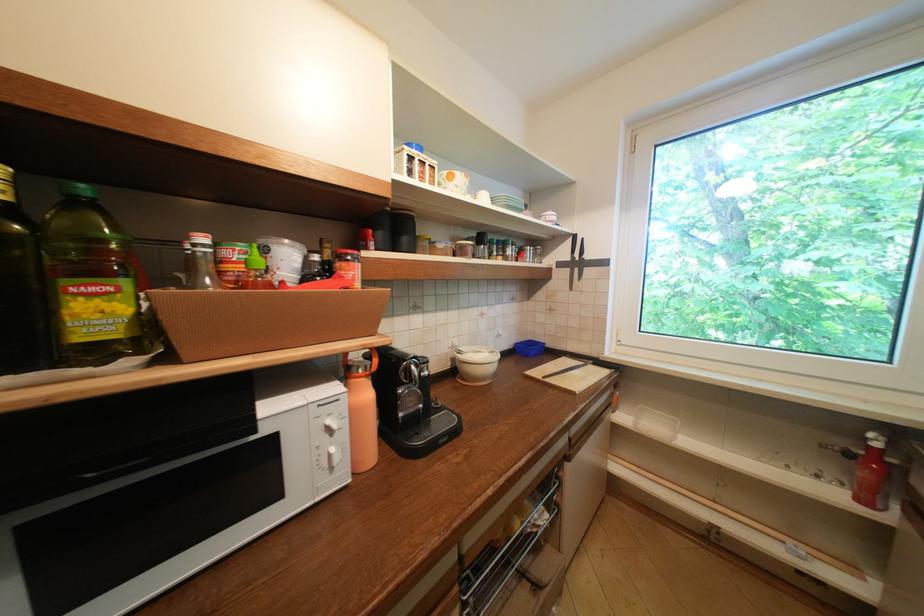
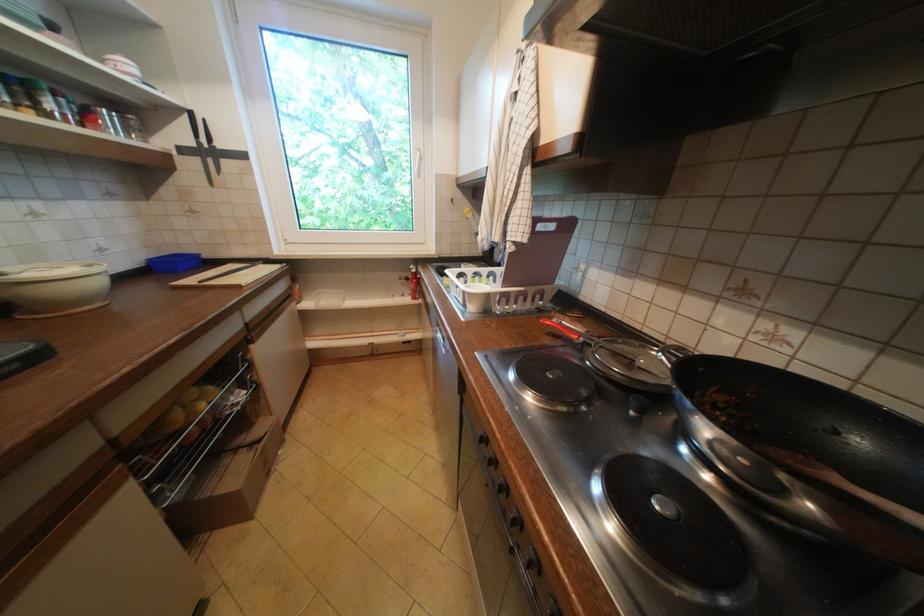
In the second image, find the point that corresponds to [556,546] in the first image.

(270, 419)